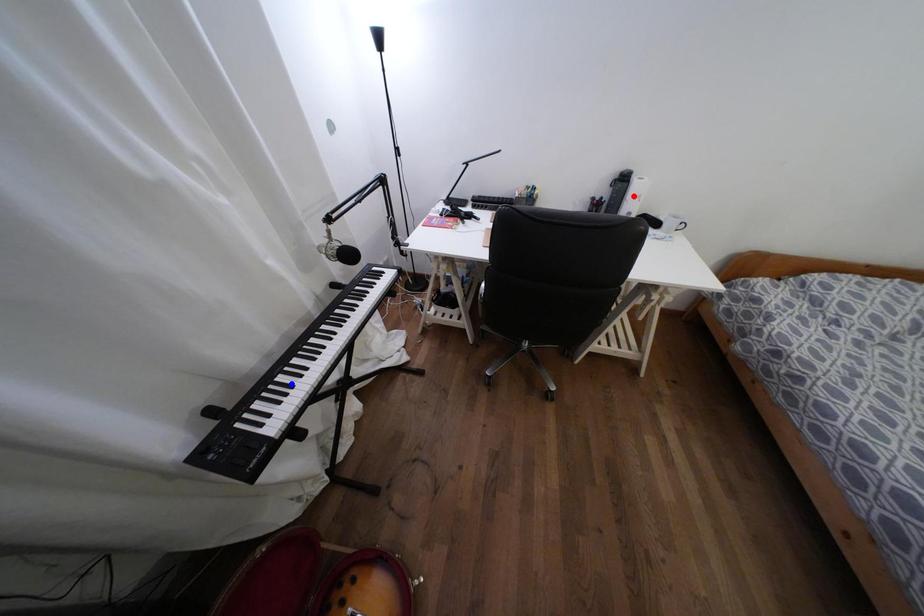
Question: In the image, two points are highlighted. Which point is nearer to the camera? Reply with the corresponding letter.

Choices:
 (A) blue point
 (B) red point

Answer: (A)